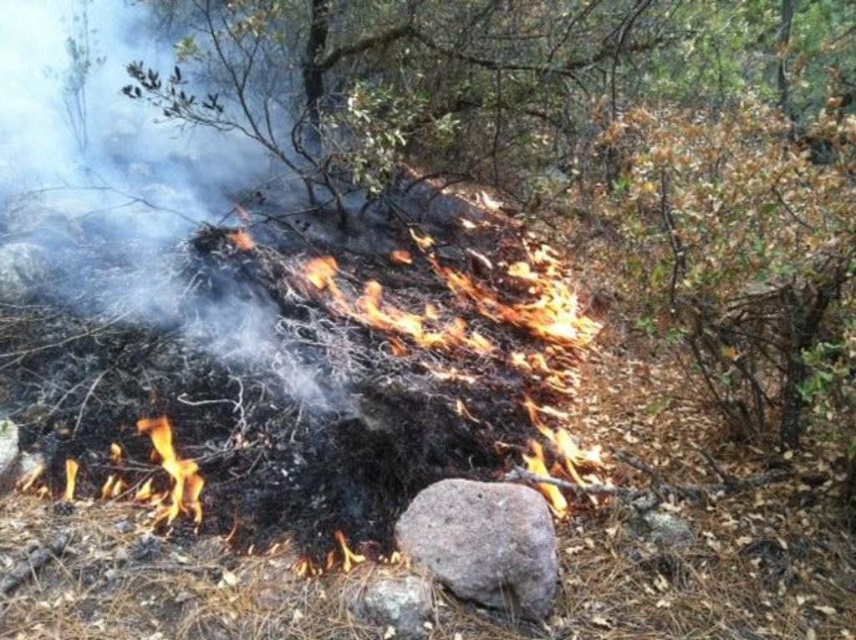
You are a firefighter assessing the wildfire scene. You notice the charred wood pile at center and the gray rough rock at center. Which object is closer to you as you approach the fire?

The charred wood pile at center is closer to you because the gray rough rock at center is behind it.

You are a firefighter assessing the wildfire scene. You notice the charred wood pile at center and the gray rough rock at center. Which object is located to the left of the other?

The charred wood pile at center is positioned on the left side of gray rough rock at center, so it is to the left of the rock.